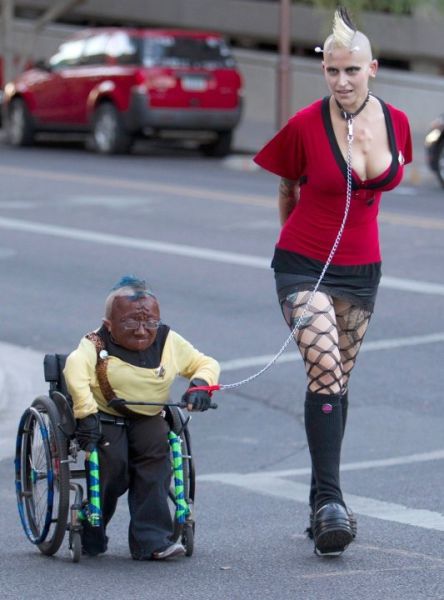
Identify the location of wheel chair. (52, 462).